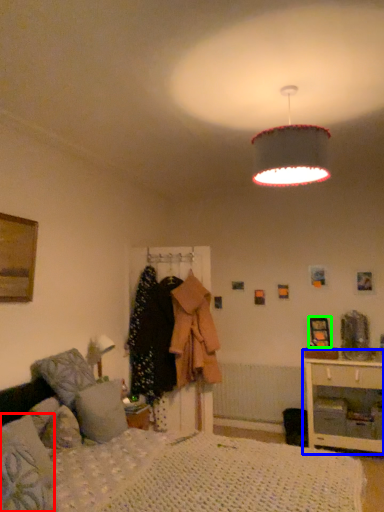
Question: Which object is the farthest from pillow (highlighted by a red box)? Choose among these: nightstand (highlighted by a blue box) or picture frame (highlighted by a green box).

Choices:
 (A) nightstand
 (B) picture frame

Answer: (B)